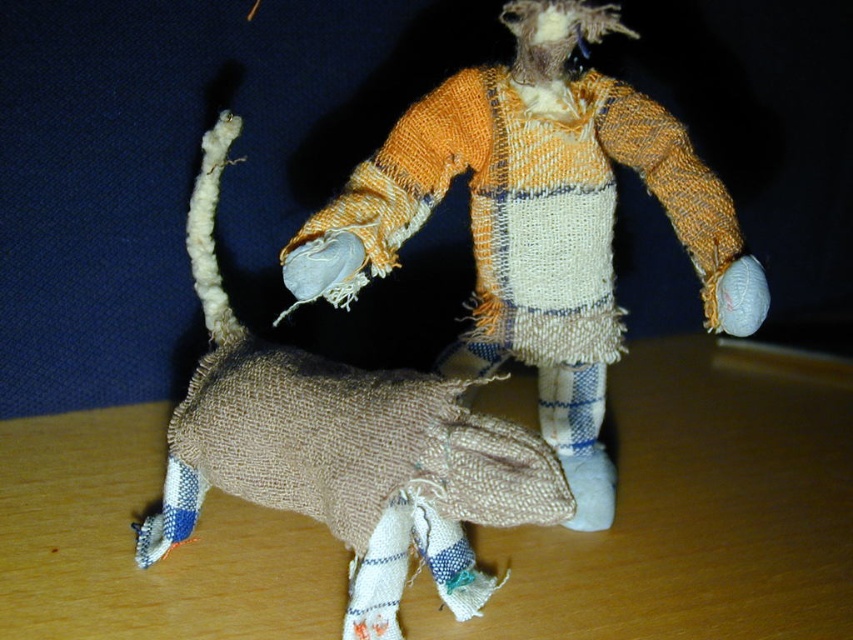
Question: Can you confirm if wooden table at center is positioned below textured burlap scarecrow at center?

Choices:
 (A) no
 (B) yes

Answer: (B)

Question: Which object is farther from the camera taking this photo?

Choices:
 (A) textured burlap scarecrow at center
 (B) burlap dog at center
 (C) wooden table at center

Answer: (A)

Question: Does wooden table at center appear over burlap dog at center?

Choices:
 (A) yes
 (B) no

Answer: (B)

Question: Can you confirm if textured burlap scarecrow at center is bigger than burlap dog at center?

Choices:
 (A) no
 (B) yes

Answer: (A)

Question: Which of the following is the closest to the observer?

Choices:
 (A) (581, 19)
 (B) (402, 464)
 (C) (401, 608)

Answer: (B)

Question: Which of the following is the closest to the observer?

Choices:
 (A) textured burlap scarecrow at center
 (B) wooden table at center

Answer: (B)